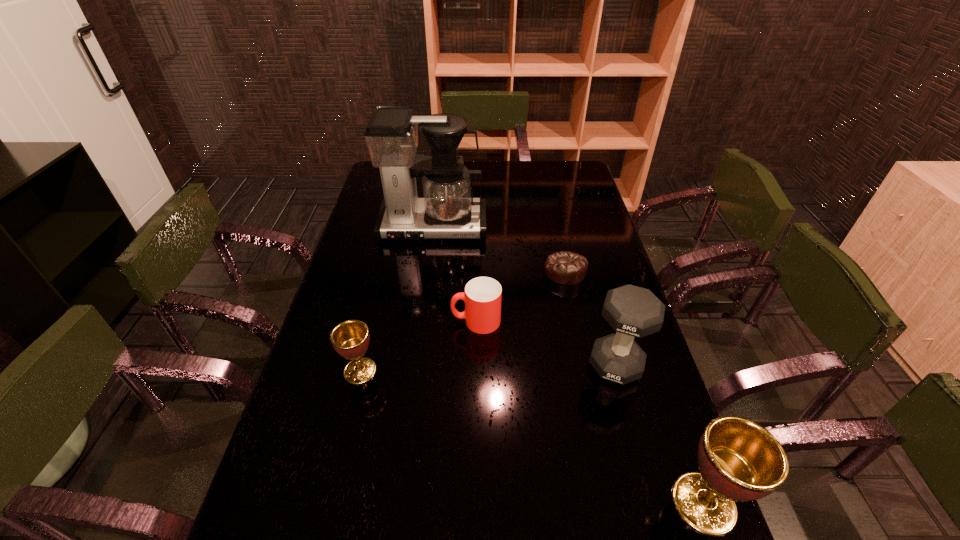
Find the location of a particular element. the farther chalice is located at coordinates (350, 339).

You are a GUI agent. You are given a task and a screenshot of the screen. Output one action in this format:
    pyautogui.click(x=<x>, y=<y>)
    Task: Click on the shorter chalice
    Image resolution: width=960 pixels, height=540 pixels.
    Given the screenshot: What is the action you would take?
    pyautogui.click(x=350, y=339)

Where is `the taller chalice`? This screenshot has height=540, width=960. the taller chalice is located at coordinates (739, 460).

The width and height of the screenshot is (960, 540). Identify the location of the nearer chalice. (739, 460).

This screenshot has width=960, height=540. What are the coordinates of `the fifth nearest object` in the screenshot? It's located at (567, 268).

Where is `the shortest object`? Image resolution: width=960 pixels, height=540 pixels. the shortest object is located at coordinates (567, 268).

You are a GUI agent. You are given a task and a screenshot of the screen. Output one action in this format:
    pyautogui.click(x=<x>, y=<y>)
    Task: Click on the fourth nearest object
    This screenshot has height=540, width=960.
    Given the screenshot: What is the action you would take?
    pyautogui.click(x=482, y=296)

This screenshot has width=960, height=540. I want to click on the tallest object, so click(447, 210).

The height and width of the screenshot is (540, 960). I want to click on coffee maker, so click(447, 210).

This screenshot has width=960, height=540. I want to click on dumbbell, so click(x=632, y=311).